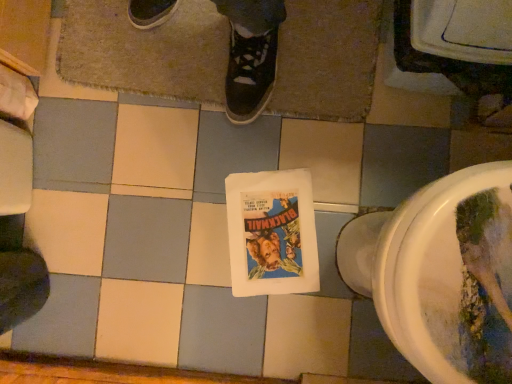
I want to click on blank space above matte paper comic book at center (from a real-world perspective), so click(249, 248).